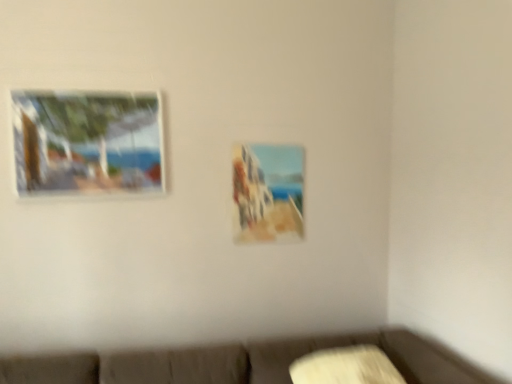
Question: Visually, is matte wooden picture frame at upper left, which is the second picture frame in right-to-left order, positioned to the left or to the right of matte glass painting at center, the first picture frame when ordered from right to left?

Choices:
 (A) right
 (B) left

Answer: (B)

Question: Considering the positions of matte wooden picture frame at upper left, the 1th picture frame when ordered from front to back, and matte glass painting at center, which is counted as the 2th picture frame, starting from the front, in the image, is matte wooden picture frame at upper left, the 1th picture frame when ordered from front to back, bigger or smaller than matte glass painting at center, which is counted as the 2th picture frame, starting from the front,?

Choices:
 (A) small
 (B) big

Answer: (B)

Question: Is matte wooden picture frame at upper left, which is the second picture frame in right-to-left order, situated inside matte glass painting at center, the first picture frame when ordered from right to left, or outside?

Choices:
 (A) inside
 (B) outside

Answer: (B)

Question: From the image's perspective, relative to matte wooden picture frame at upper left, arranged as the second picture frame when viewed from the back, is matte glass painting at center, marked as the 1th picture frame in a back-to-front arrangement, above or below?

Choices:
 (A) below
 (B) above

Answer: (A)

Question: Based on their sizes in the image, would you say matte glass painting at center, which is counted as the 2th picture frame, starting from the left, is bigger or smaller than matte wooden picture frame at upper left, arranged as the second picture frame when viewed from the back?

Choices:
 (A) big
 (B) small

Answer: (B)

Question: In terms of width, does matte glass painting at center, marked as the 1th picture frame in a back-to-front arrangement, look wider or thinner when compared to matte wooden picture frame at upper left, arranged as the second picture frame when viewed from the back?

Choices:
 (A) wide
 (B) thin

Answer: (B)

Question: From a real-world perspective, is matte glass painting at center, which is counted as the 2th picture frame, starting from the front, physically located above or below matte wooden picture frame at upper left, the 1th picture frame when ordered from front to back?

Choices:
 (A) above
 (B) below

Answer: (B)